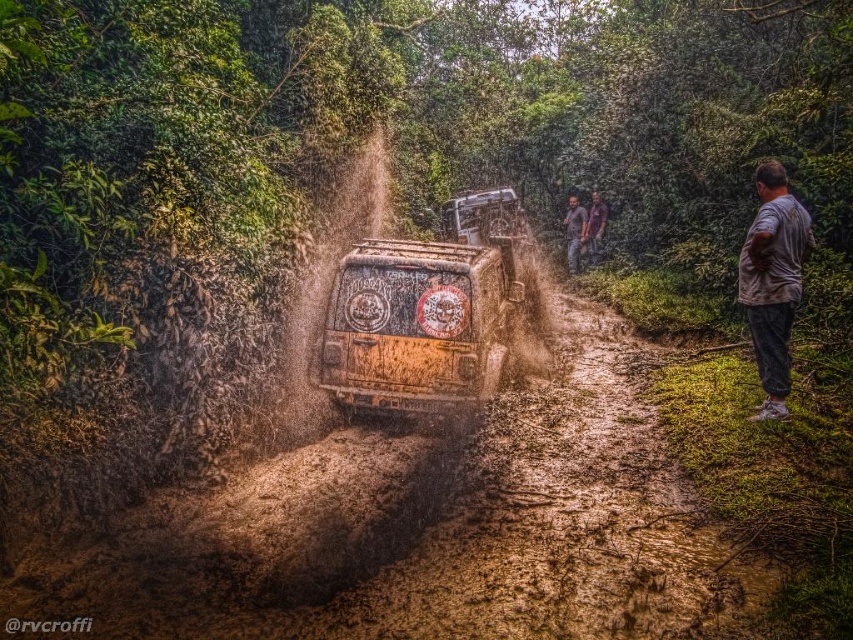
Question: Is gray cotton shirt at right smaller than brown fabric shirt at upper center?

Choices:
 (A) yes
 (B) no

Answer: (B)

Question: Does muddy terrain at center have a lesser width compared to brown fabric shirt at upper center?

Choices:
 (A) yes
 (B) no

Answer: (B)

Question: Is muddy terrain at center thinner than brown textured shirt at upper center?

Choices:
 (A) no
 (B) yes

Answer: (A)

Question: Which point is farther from the camera taking this photo?

Choices:
 (A) (433, 339)
 (B) (589, 225)
 (C) (767, 317)
 (D) (344, 436)

Answer: (B)

Question: Which of these objects is positioned farthest from the gray cotton shirt at right?

Choices:
 (A) muddy terrain at center
 (B) brown textured shirt at upper center

Answer: (B)

Question: Which point is closer to the camera?

Choices:
 (A) rusty metallic truck at center
 (B) brown textured shirt at upper center

Answer: (A)